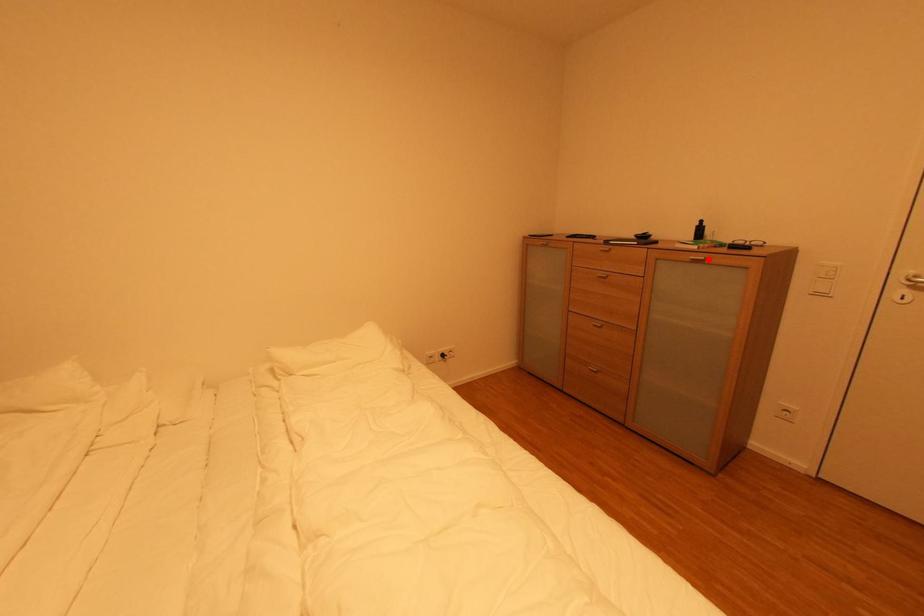
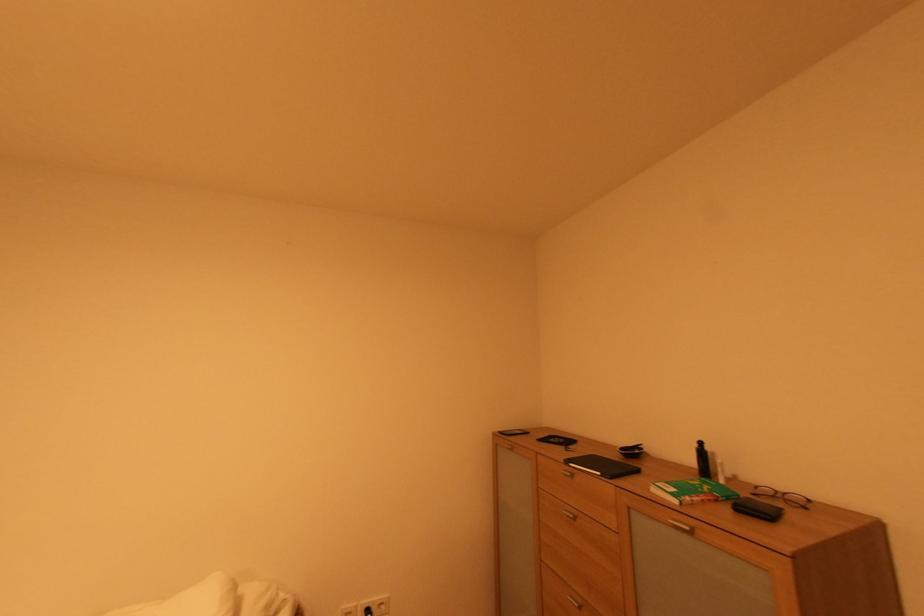
The point at the highlighted location is marked in the first image. Where is the corresponding point in the second image?

(694, 530)